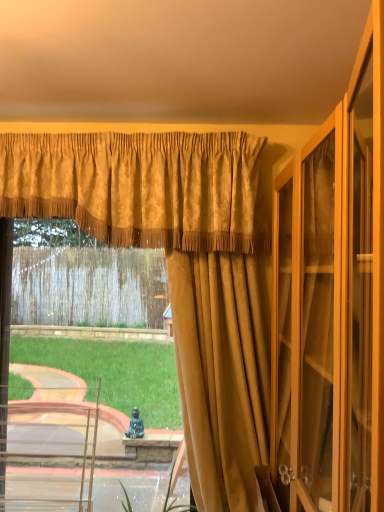
Where is `gold textured curtain at center, positioned as the 1th curtain in back-to-front order`? This screenshot has width=384, height=512. gold textured curtain at center, positioned as the 1th curtain in back-to-front order is located at coordinates (178, 269).

This screenshot has width=384, height=512. Find the location of `gold textured curtain at center, positioned as the 1th curtain in back-to-front order`. gold textured curtain at center, positioned as the 1th curtain in back-to-front order is located at coordinates (178, 269).

Is suede-like gold curtain at center, which appears as the third curtain when viewed from the back, further to the viewer compared to gold textured valance at upper center, which ranks as the 2th curtain in front-to-back order?

No, suede-like gold curtain at center, which appears as the third curtain when viewed from the back, is closer to the viewer.

Considering the sizes of objects suede-like gold curtain at center, which appears as the third curtain when viewed from the back, and gold textured valance at upper center, which ranks as the 2th curtain in front-to-back order, in the image provided, who is shorter, suede-like gold curtain at center, which appears as the third curtain when viewed from the back, or gold textured valance at upper center, which ranks as the 2th curtain in front-to-back order,?

gold textured valance at upper center, which ranks as the 2th curtain in front-to-back order, is shorter.

Is suede-like gold curtain at center, the first curtain viewed from the front, turned away from gold textured valance at upper center, which ranks as the 2th curtain in front-to-back order?

No, suede-like gold curtain at center, the first curtain viewed from the front,'s orientation is not away from gold textured valance at upper center, which ranks as the 2th curtain in front-to-back order.

Does gold textured valance at upper center, which is the 2th curtain in back-to-front order, have a lesser height compared to suede-like gold curtain at center, which appears as the third curtain when viewed from the back?

Yes.

Between gold textured valance at upper center, which is the 2th curtain in back-to-front order, and suede-like gold curtain at center, which appears as the third curtain when viewed from the back, which one has larger width?

With larger width is gold textured valance at upper center, which is the 2th curtain in back-to-front order.

How many degrees apart are the facing directions of gold textured valance at upper center, which ranks as the 2th curtain in front-to-back order, and suede-like gold curtain at center, the first curtain viewed from the front?

gold textured valance at upper center, which ranks as the 2th curtain in front-to-back order, and suede-like gold curtain at center, the first curtain viewed from the front, are facing 5.37 degrees away from each other.

Is gold textured curtain at center, positioned as the 1th curtain in back-to-front order, turned away from suede-like gold curtain at center, which appears as the third curtain when viewed from the back?

gold textured curtain at center, positioned as the 1th curtain in back-to-front order, does not have its back to suede-like gold curtain at center, which appears as the third curtain when viewed from the back.

Considering the sizes of objects gold textured curtain at center, positioned as the 1th curtain in back-to-front order, and suede-like gold curtain at center, the first curtain viewed from the front, in the image provided, who is smaller, gold textured curtain at center, positioned as the 1th curtain in back-to-front order, or suede-like gold curtain at center, the first curtain viewed from the front,?

suede-like gold curtain at center, the first curtain viewed from the front, is smaller.

Considering the relative positions of gold textured curtain at center, arranged as the third curtain when viewed from the front, and suede-like gold curtain at center, the first curtain viewed from the front, in the image provided, is gold textured curtain at center, arranged as the third curtain when viewed from the front, behind suede-like gold curtain at center, the first curtain viewed from the front,?

Yes.

Would you say gold textured curtain at center, arranged as the third curtain when viewed from the front, is inside or outside suede-like gold curtain at center, the first curtain viewed from the front?

gold textured curtain at center, arranged as the third curtain when viewed from the front, is not inside suede-like gold curtain at center, the first curtain viewed from the front, it's outside.

In terms of size, does gold textured valance at upper center, which is the 2th curtain in back-to-front order, appear bigger or smaller than gold textured curtain at center, arranged as the third curtain when viewed from the front?

Clearly, gold textured valance at upper center, which is the 2th curtain in back-to-front order, is smaller in size than gold textured curtain at center, arranged as the third curtain when viewed from the front.

Is gold textured valance at upper center, which ranks as the 2th curtain in front-to-back order, facing towards gold textured curtain at center, positioned as the 1th curtain in back-to-front order?

No, gold textured valance at upper center, which ranks as the 2th curtain in front-to-back order, is not aimed at gold textured curtain at center, positioned as the 1th curtain in back-to-front order.

Between gold textured valance at upper center, which ranks as the 2th curtain in front-to-back order, and gold textured curtain at center, arranged as the third curtain when viewed from the front, which one is positioned in front?

gold textured valance at upper center, which ranks as the 2th curtain in front-to-back order.

Is the depth of suede-like gold curtain at center, the first curtain viewed from the front, greater than that of gold textured curtain at center, arranged as the third curtain when viewed from the front?

No, it is in front of gold textured curtain at center, arranged as the third curtain when viewed from the front.

Is there a large distance between suede-like gold curtain at center, which appears as the third curtain when viewed from the back, and gold textured curtain at center, positioned as the 1th curtain in back-to-front order?

No, suede-like gold curtain at center, which appears as the third curtain when viewed from the back, is in close proximity to gold textured curtain at center, positioned as the 1th curtain in back-to-front order.

Can you confirm if suede-like gold curtain at center, which appears as the third curtain when viewed from the back, is shorter than gold textured curtain at center, positioned as the 1th curtain in back-to-front order?

No.

From the image's perspective, does suede-like gold curtain at center, which appears as the third curtain when viewed from the back, appear higher than gold textured curtain at center, arranged as the third curtain when viewed from the front?

Yes.

Is gold textured curtain at center, positioned as the 1th curtain in back-to-front order, far away from gold textured valance at upper center, which is the 2th curtain in back-to-front order?

No.

Can you confirm if gold textured curtain at center, arranged as the third curtain when viewed from the front, is wider than gold textured valance at upper center, which ranks as the 2th curtain in front-to-back order?

No, gold textured curtain at center, arranged as the third curtain when viewed from the front, is not wider than gold textured valance at upper center, which ranks as the 2th curtain in front-to-back order.

Between point (68, 201) and point (104, 215), which one is positioned in front?

The point (104, 215) is in front.

The width and height of the screenshot is (384, 512). Find the location of `curtain lying on the left of gold textured valance at upper center, which is the 2th curtain in back-to-front order`. curtain lying on the left of gold textured valance at upper center, which is the 2th curtain in back-to-front order is located at coordinates pos(178,269).

This screenshot has height=512, width=384. Identify the location of curtain on the right side of gold textured valance at upper center, which is the 2th curtain in back-to-front order. (222, 371).

At what (x,y) coordinates should I click in order to perform the action: click on curtain in front of the gold textured valance at upper center, which is the 2th curtain in back-to-front order. Please return your answer as a coordinate pair (x, y). This screenshot has width=384, height=512. Looking at the image, I should click on (222, 371).

Which object lies further to the anchor point gold textured curtain at center, arranged as the third curtain when viewed from the front, suede-like gold curtain at center, the first curtain viewed from the front, or gold textured valance at upper center, which is the 2th curtain in back-to-front order?

gold textured valance at upper center, which is the 2th curtain in back-to-front order, is positioned further to the anchor gold textured curtain at center, arranged as the third curtain when viewed from the front.

When comparing their distances from gold textured curtain at center, positioned as the 1th curtain in back-to-front order, does gold textured valance at upper center, which is the 2th curtain in back-to-front order, or suede-like gold curtain at center, the first curtain viewed from the front, seem further?

Based on the image, gold textured valance at upper center, which is the 2th curtain in back-to-front order, appears to be further to gold textured curtain at center, positioned as the 1th curtain in back-to-front order.

From the image, which object appears to be nearer to suede-like gold curtain at center, the first curtain viewed from the front, gold textured curtain at center, arranged as the third curtain when viewed from the front, or gold textured valance at upper center, which is the 2th curtain in back-to-front order?

gold textured curtain at center, arranged as the third curtain when viewed from the front, is closer to suede-like gold curtain at center, the first curtain viewed from the front.

Looking at this image, considering their positions, is gold textured valance at upper center, which ranks as the 2th curtain in front-to-back order, positioned closer to suede-like gold curtain at center, the first curtain viewed from the front, than gold textured curtain at center, positioned as the 1th curtain in back-to-front order?

gold textured curtain at center, positioned as the 1th curtain in back-to-front order, is positioned closer to the anchor suede-like gold curtain at center, the first curtain viewed from the front.

Estimate the real-world distances between objects in this image. Which object is closer to gold textured valance at upper center, which is the 2th curtain in back-to-front order, gold textured curtain at center, arranged as the third curtain when viewed from the front, or suede-like gold curtain at center, which appears as the third curtain when viewed from the back?

gold textured curtain at center, arranged as the third curtain when viewed from the front, is positioned closer to the anchor gold textured valance at upper center, which is the 2th curtain in back-to-front order.

From the image, which object appears to be nearer to gold textured valance at upper center, which ranks as the 2th curtain in front-to-back order, suede-like gold curtain at center, the first curtain viewed from the front, or gold textured curtain at center, arranged as the third curtain when viewed from the front?

gold textured curtain at center, arranged as the third curtain when viewed from the front, is closer to gold textured valance at upper center, which ranks as the 2th curtain in front-to-back order.

The width and height of the screenshot is (384, 512). I want to click on curtain that lies between gold textured valance at upper center, which is the 2th curtain in back-to-front order, and gold textured curtain at center, positioned as the 1th curtain in back-to-front order, from top to bottom, so click(222, 371).